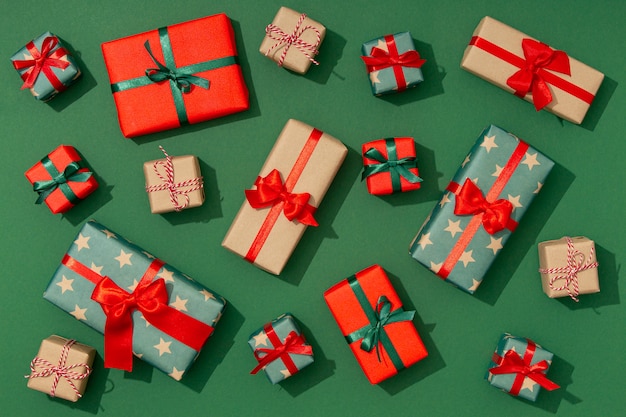
Locate an element on the screen. The width and height of the screenshot is (626, 417). gifts with red bows is located at coordinates (116, 292), (44, 59), (280, 187), (284, 348), (521, 368), (473, 198), (397, 62), (541, 67).